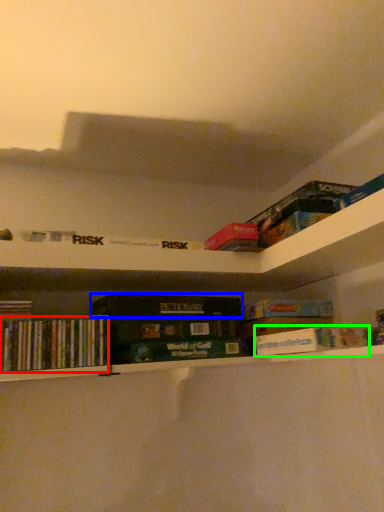
Question: Based on their relative distances, which object is farther from book (highlighted by a red box)? Choose from paperback book (highlighted by a blue box) and book (highlighted by a green box).

Choices:
 (A) paperback book
 (B) book

Answer: (B)